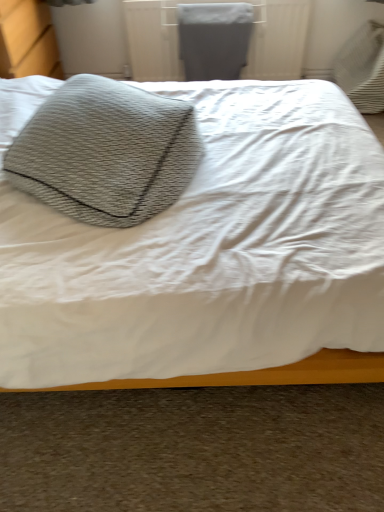
Question: From a real-world perspective, is textured gray pillow at upper left under textured gray pillow at upper left?

Choices:
 (A) yes
 (B) no

Answer: (A)

Question: Is there a large distance between textured gray pillow at upper left and textured gray pillow at upper left?

Choices:
 (A) yes
 (B) no

Answer: (B)

Question: Is textured gray pillow at upper left positioned in front of textured gray pillow at upper left?

Choices:
 (A) no
 (B) yes

Answer: (B)

Question: Can you confirm if textured gray pillow at upper left is bigger than textured gray pillow at upper left?

Choices:
 (A) yes
 (B) no

Answer: (A)

Question: Is textured gray pillow at upper left to the left of textured gray pillow at upper left from the viewer's perspective?

Choices:
 (A) no
 (B) yes

Answer: (A)

Question: From the image's perspective, is textured gray pillow at upper left located above or below textured gray pillow at upper left?

Choices:
 (A) above
 (B) below

Answer: (A)

Question: From a real-world perspective, is textured gray pillow at upper left physically located above or below textured gray pillow at upper left?

Choices:
 (A) above
 (B) below

Answer: (A)

Question: From their relative heights in the image, would you say textured gray pillow at upper left is taller or shorter than textured gray pillow at upper left?

Choices:
 (A) short
 (B) tall

Answer: (A)

Question: Based on their sizes in the image, would you say textured gray pillow at upper left is bigger or smaller than textured gray pillow at upper left?

Choices:
 (A) big
 (B) small

Answer: (B)

Question: Considering the positions of textured gray pillow at upper left and textured gray pillow at upper left in the image, is textured gray pillow at upper left taller or shorter than textured gray pillow at upper left?

Choices:
 (A) short
 (B) tall

Answer: (B)

Question: From the image's perspective, is textured gray pillow at upper left above or below textured gray pillow at upper left?

Choices:
 (A) below
 (B) above

Answer: (A)

Question: In the image, is textured gray pillow at upper left positioned in front of or behind textured gray pillow at upper left?

Choices:
 (A) front
 (B) behind

Answer: (A)

Question: Visually, is textured gray pillow at upper left positioned to the left or to the right of textured gray pillow at upper left?

Choices:
 (A) right
 (B) left

Answer: (A)

Question: Looking at their shapes, would you say matte gray radiator at upper center is wider or thinner than textured gray pillow at upper left?

Choices:
 (A) wide
 (B) thin

Answer: (B)

Question: Considering the positions of matte gray radiator at upper center and textured gray pillow at upper left in the image, is matte gray radiator at upper center bigger or smaller than textured gray pillow at upper left?

Choices:
 (A) big
 (B) small

Answer: (B)